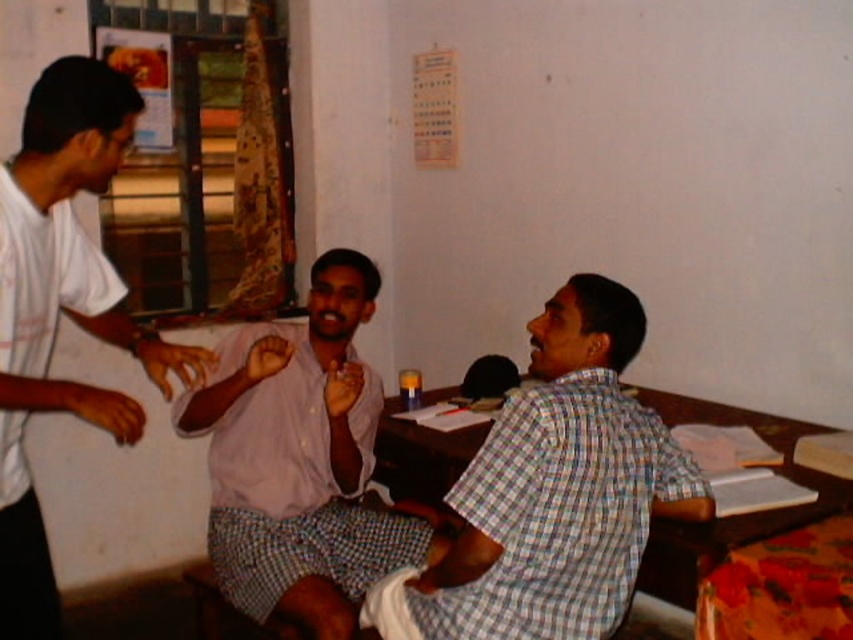
Question: Is the position of light pink shirt at center less distant than that of wooden at right?

Choices:
 (A) no
 (B) yes

Answer: (A)

Question: Considering the relative positions of light pink shirt at center and wooden at right in the image provided, where is light pink shirt at center located with respect to wooden at right?

Choices:
 (A) above
 (B) below

Answer: (A)

Question: Which of the following is the farthest from the observer?

Choices:
 (A) light pink shirt at center
 (B) wooden at right

Answer: (A)

Question: Does light pink shirt at center appear on the left side of white cotton shirt at left?

Choices:
 (A) no
 (B) yes

Answer: (A)

Question: Which point appears closest to the camera in this image?

Choices:
 (A) (828, 480)
 (B) (45, 307)
 (C) (323, 348)

Answer: (B)

Question: Among these points, which one is farthest from the camera?

Choices:
 (A) (347, 358)
 (B) (733, 540)

Answer: (A)